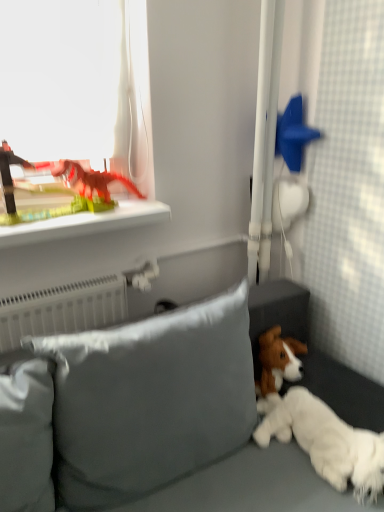
Where is `vacant region above green plastic dinosaur at upper left (from a real-world perspective)`? This screenshot has width=384, height=512. vacant region above green plastic dinosaur at upper left (from a real-world perspective) is located at coordinates (80, 212).